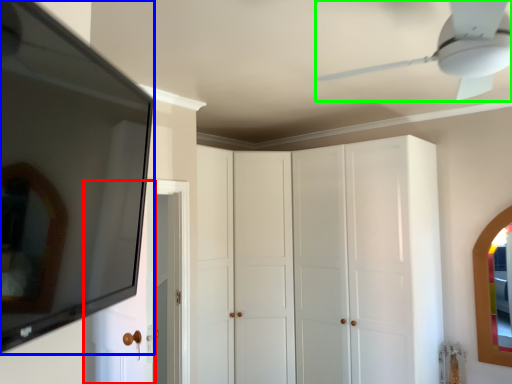
Question: Which object is the closest to the door (highlighted by a red box)? Choose among these: mirror (highlighted by a blue box) or ceiling fan (highlighted by a green box).

Choices:
 (A) mirror
 (B) ceiling fan

Answer: (A)